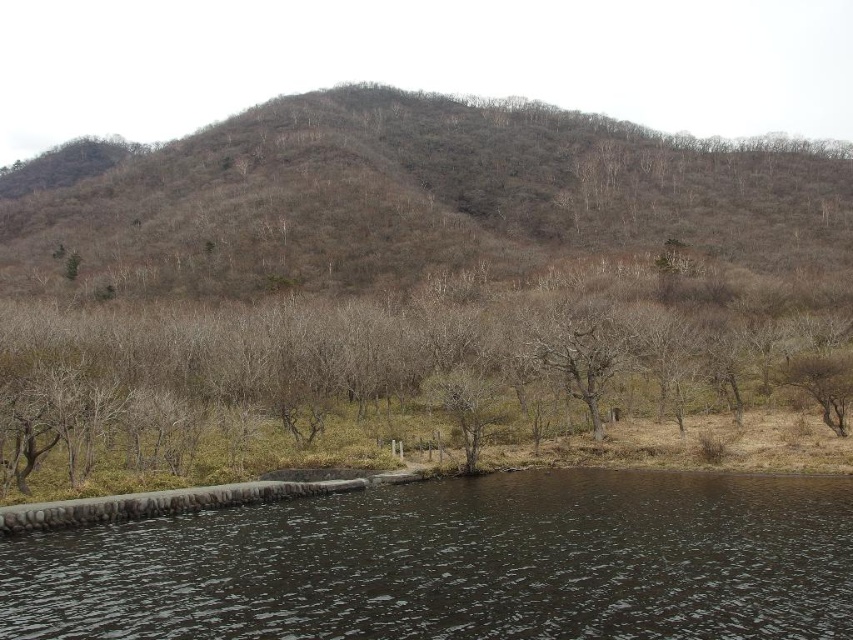
Question: Which point is closer to the camera?

Choices:
 (A) (489, 243)
 (B) (151, 528)

Answer: (B)

Question: Is brown dry wood at center closer to camera compared to brown/drymaterial/texture mountain at upper center?

Choices:
 (A) no
 (B) yes

Answer: (B)

Question: Is dark water at lower center positioned behind brown/drymaterial/texture mountain at upper center?

Choices:
 (A) yes
 (B) no

Answer: (B)

Question: Can you confirm if brown dry wood at center is smaller than dark water at lower center?

Choices:
 (A) no
 (B) yes

Answer: (A)

Question: Which object is farther from the camera taking this photo?

Choices:
 (A) dark water at lower center
 (B) brown/drymaterial/texture mountain at upper center

Answer: (B)

Question: Which object appears closest to the camera in this image?

Choices:
 (A) brown dry wood at center
 (B) brown/drymaterial/texture mountain at upper center
 (C) dark water at lower center

Answer: (C)